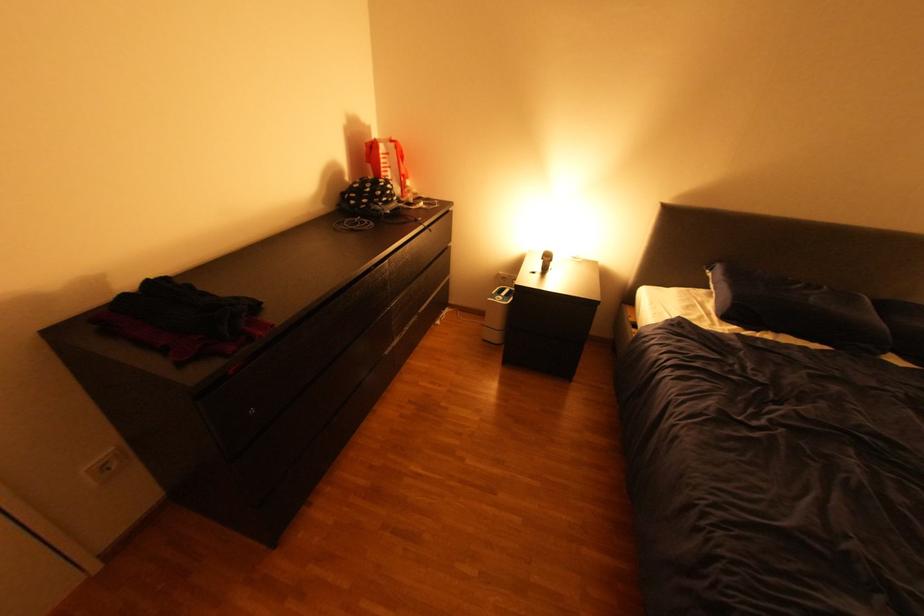
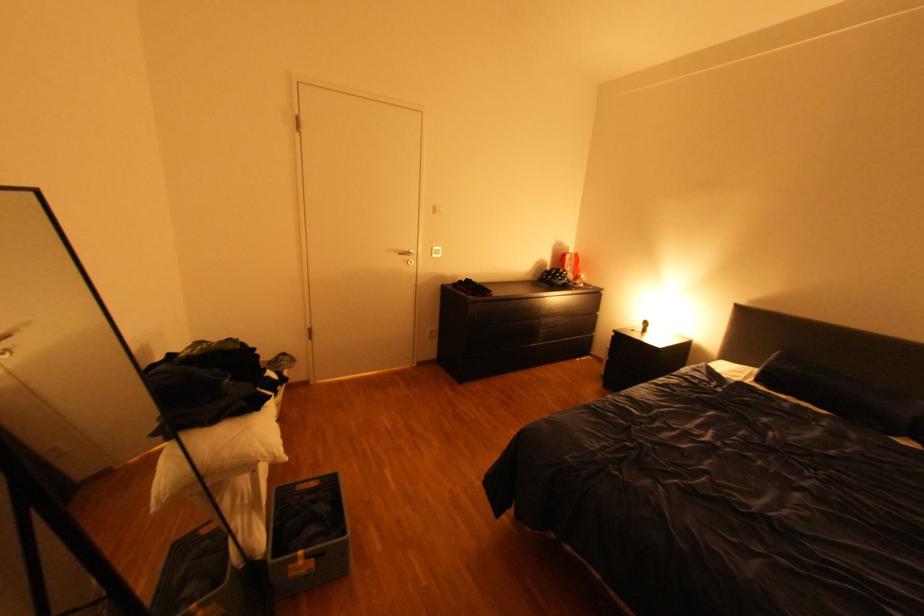
The point at (745, 326) is marked in the first image. Where is the corresponding point in the second image?

(771, 387)